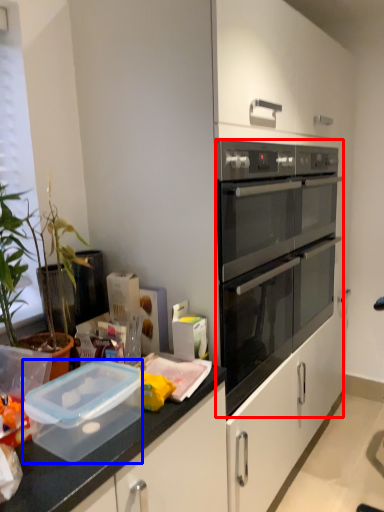
Question: Which object is closer to the camera taking this photo, oven (highlighted by a red box) or appliance (highlighted by a blue box)?

Choices:
 (A) oven
 (B) appliance

Answer: (B)